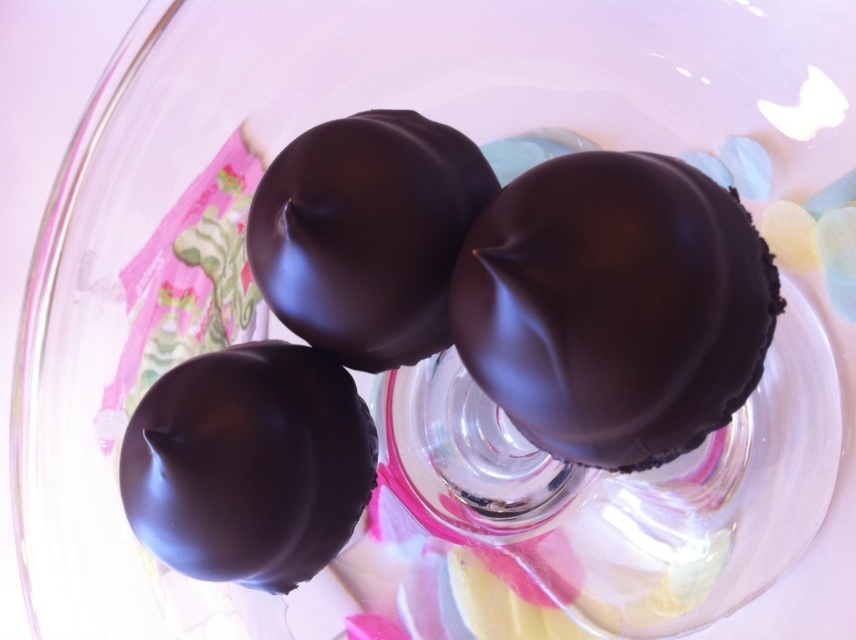
You are arranging a dessert display and need to place a decorative plate at coordinate point 0.727, 0.291. There is a matte dark chocolate at lower left in the bowl. Will the chocolate interfere with placing the plate at that coordinate?

The matte dark chocolate at lower left is positioned exactly at point (248, 465), so placing the decorative plate there would interfere with the chocolate.

You are arranging a dessert display and need to place a decorative plate between the matte dark chocolate at lower left and the matte chocolate truffle at center. Based on their positions, which chocolate will the plate be closer to?

The plate will be closer to the matte dark chocolate at lower left because it is positioned closer to the viewer than the matte chocolate truffle at center.

You are arranging chocolates in a glass bowl and notice two points marked in the image. The first point is at coordinates point (x=467, y=264), and the second is at point (x=373, y=305). If you want to place a new chocolate between them, which coordinate should you aim for?

To place a new chocolate between point (x=467, y=264) and point (x=373, y=305), you should aim for the midpoint between them. The midpoint coordinates would be calculated by averaging the x and y values of both points. The midpoint is at x coordinate 0.414 and 0.478 divided by 2 equals 0.446, and y coordinate 0.546 and 0.438 divided by 2 equals 0.492. Therefore, the midpoint is at point 0.446, 0.492.